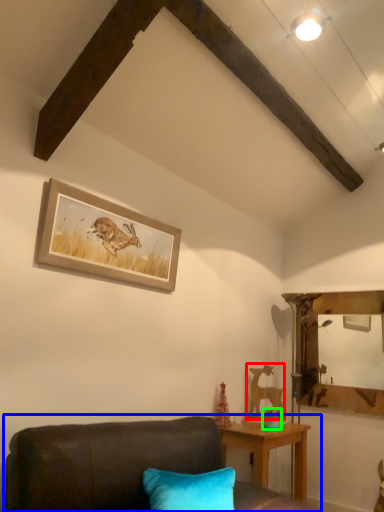
Question: Estimate the real-world distances between objects in this image. Which object is farther from animal (highlighted by a red box), studio couch (highlighted by a blue box) or teal (highlighted by a green box)?

Choices:
 (A) studio couch
 (B) teal

Answer: (A)